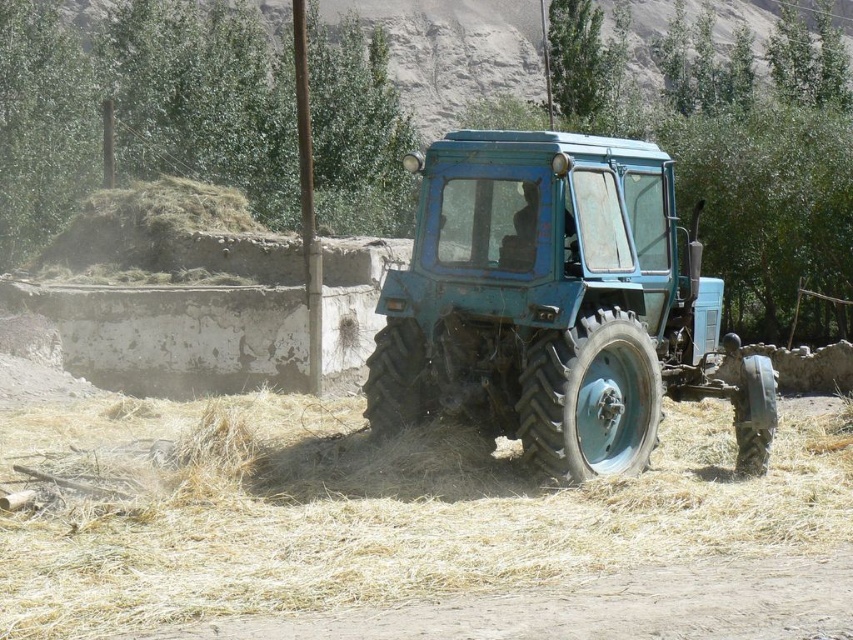
Looking at this image, can you confirm if dry straw at center is shorter than blue matte tractor at center?

Yes.

Does dry straw at center have a smaller size compared to blue matte tractor at center?

No.

Image resolution: width=853 pixels, height=640 pixels. Describe the element at coordinates (369, 509) in the screenshot. I see `dry straw at center` at that location.

Image resolution: width=853 pixels, height=640 pixels. Identify the location of dry straw at center. (369, 509).

Who is positioned more to the left, dry straw at center or dirt track at lower center?

From the viewer's perspective, dry straw at center appears more on the left side.

Is point (340, 545) farther from camera compared to point (293, 627)?

That is True.

Find the location of a particular element. dry straw at center is located at coordinates (369, 509).

Is blue matte tractor at center below dirt track at lower center?

No, blue matte tractor at center is not below dirt track at lower center.

Is blue matte tractor at center above dirt track at lower center?

Yes.

Image resolution: width=853 pixels, height=640 pixels. I want to click on blue matte tractor at center, so click(x=556, y=304).